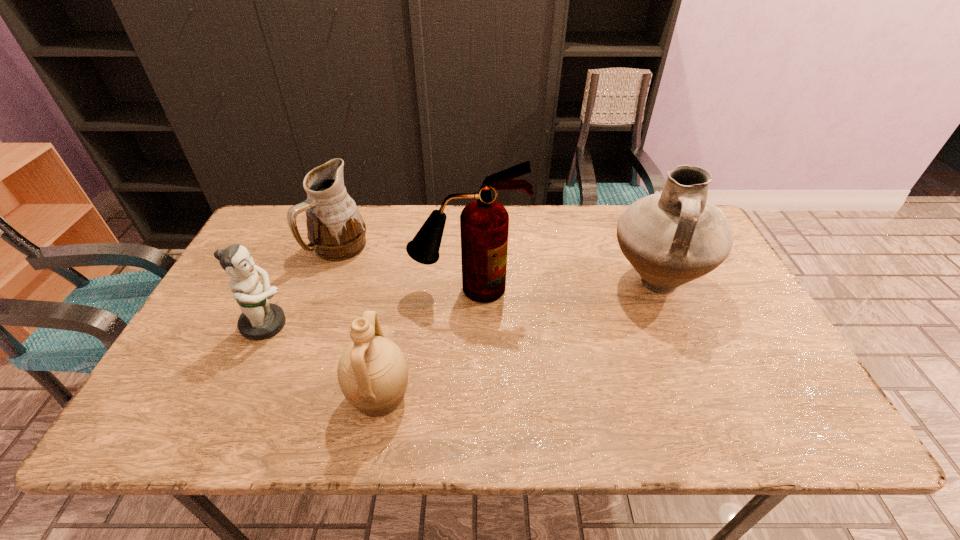
Identify the location of free space located on the front-facing side of the figurine. (374, 325).

I want to click on free space located 0.330m on the right of the nearest object, so click(x=560, y=397).

I want to click on object that is at the far edge, so click(336, 231).

The height and width of the screenshot is (540, 960). I want to click on object that is positioned at the near edge, so 372,372.

In order to click on object present at the left edge in this screenshot , I will do `click(259, 320)`.

Find the location of a particular element. object that is at the right edge is located at coordinates (671, 238).

In the image, there is a desktop. Identify the location of vacant space at the far edge. (525, 249).

Locate an element on the screen. Image resolution: width=960 pixels, height=540 pixels. vacant space at the near edge of the desktop is located at coordinates (613, 436).

In the image, there is a desktop. Where is `vacant space at the left edge`? This screenshot has width=960, height=540. vacant space at the left edge is located at coordinates (193, 346).

In the image, there is a desktop. Identify the location of vacant space at the right edge. (761, 373).